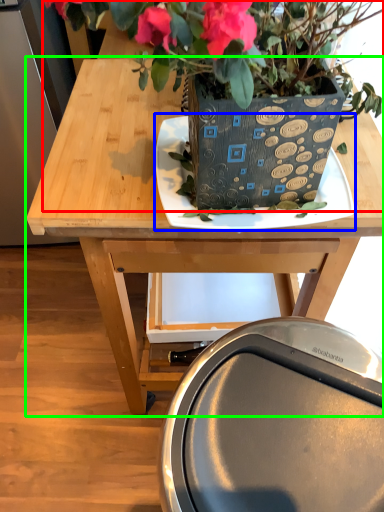
Question: Which object is positioned closest to houseplant (highlighted by a red box)? Select from plate (highlighted by a blue box) and table (highlighted by a green box).

Choices:
 (A) plate
 (B) table

Answer: (A)